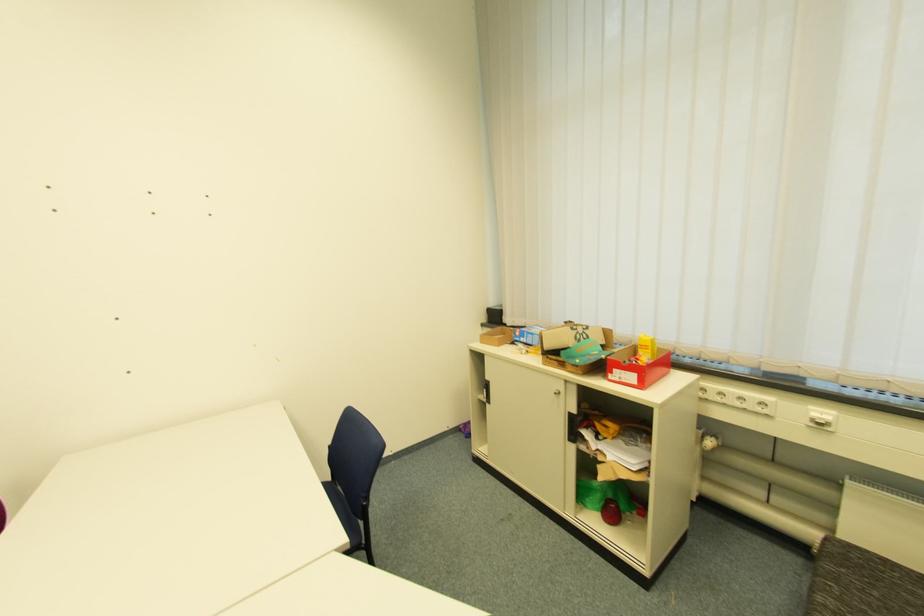
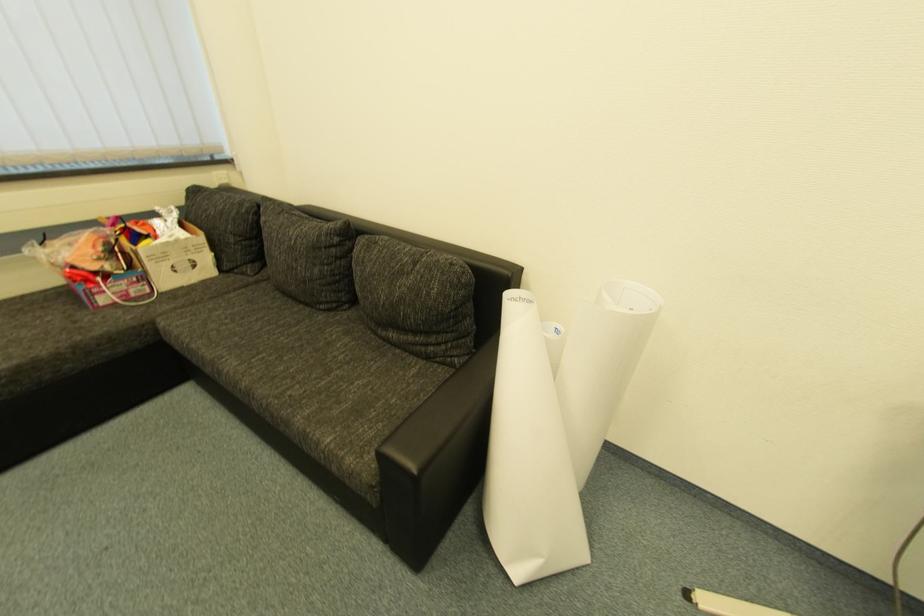
The images are taken continuously from a first-person perspective. In which direction is your viewpoint rotating?

The camera rotated toward right-down.